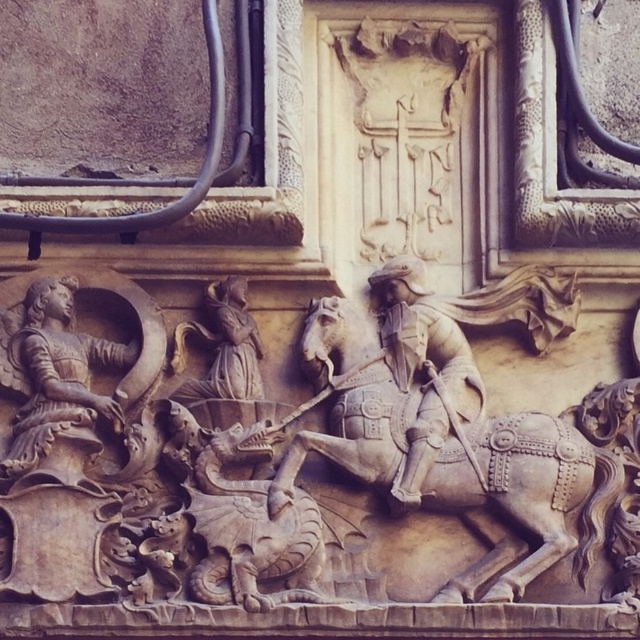
Question: Is beige stone horse at center behind stone dragon at center?

Choices:
 (A) no
 (B) yes

Answer: (A)

Question: Which point appears farthest from the camera in this image?

Choices:
 (A) (120, 364)
 (B) (209, 490)
 (C) (394, 467)

Answer: (A)

Question: Which of the following is the farthest from the observer?

Choices:
 (A) (259, 394)
 (B) (444, 474)
 (C) (134, 353)
 (D) (241, 554)

Answer: (C)

Question: From the image, what is the correct spatial relationship of beige stone horse at center in relation to stone dragon at center?

Choices:
 (A) left
 (B) right

Answer: (B)

Question: Is beige stone horse at center smaller than stone dragon at center?

Choices:
 (A) yes
 (B) no

Answer: (B)

Question: Which point is closer to the camera?

Choices:
 (A) (288, 520)
 (B) (20, 435)
 (C) (234, 326)

Answer: (A)